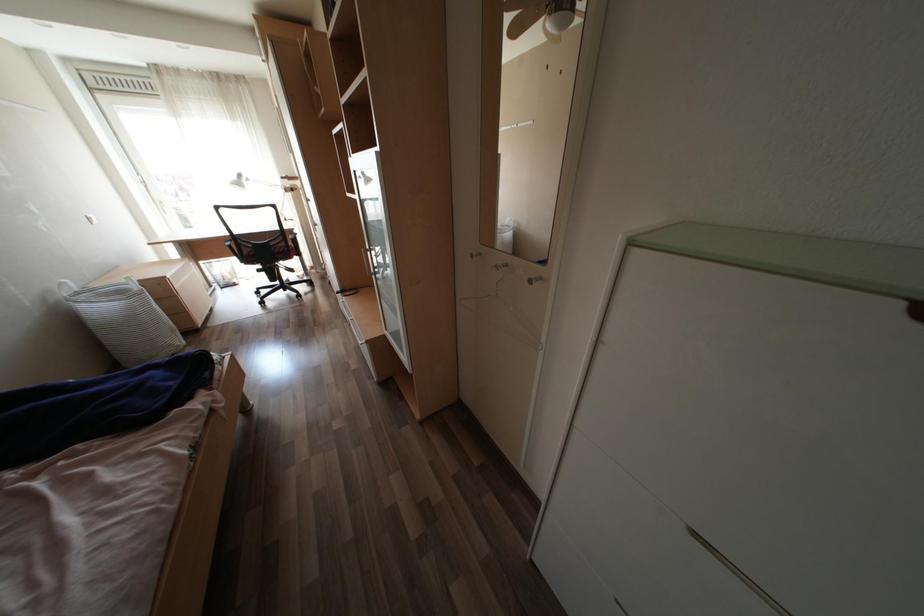
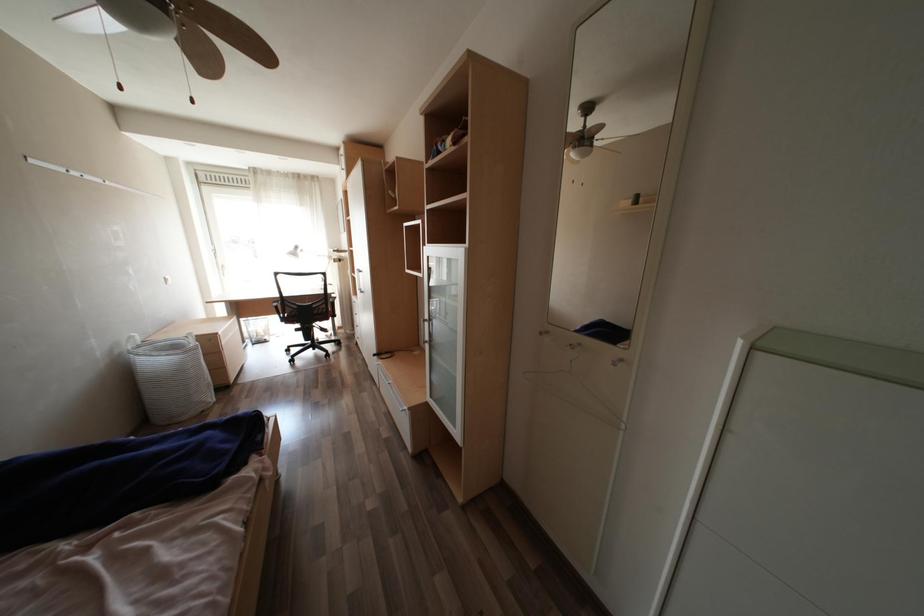
Question: The first image is from the beginning of the video and the second image is from the end. How did the camera likely rotate when shooting the video?

Choices:
 (A) Left
 (B) Right
 (C) Up
 (D) Down

Answer: (C)